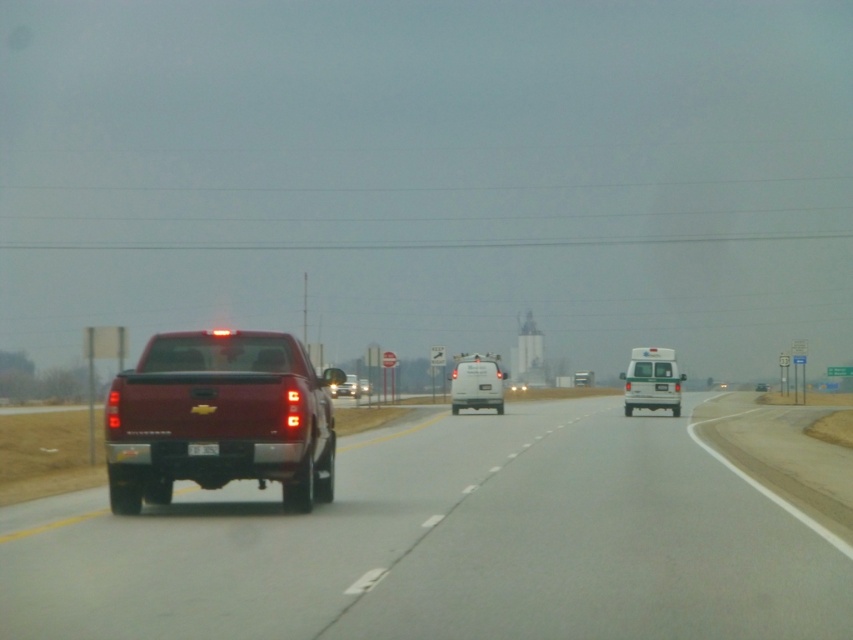
Question: Which point is closer to the camera taking this photo?

Choices:
 (A) (476, 390)
 (B) (196, 445)

Answer: (B)

Question: Is white glossy van at center behind white matte van at center?

Choices:
 (A) yes
 (B) no

Answer: (B)

Question: Which point is farther from the camera taking this photo?

Choices:
 (A) (347, 372)
 (B) (662, 384)
 (C) (276, 506)

Answer: (A)

Question: Can you confirm if metallic red truck at left is smaller than metallic red truck at center?

Choices:
 (A) yes
 (B) no

Answer: (B)

Question: Estimate the real-world distances between objects in this image. Which object is closer to the black plastic license plate at center?

Choices:
 (A) white glossy van at center
 (B) white matte van at center
 (C) shiny red truck at left

Answer: (C)

Question: Is white matte van at center wider than metallic silver sedan at center?

Choices:
 (A) yes
 (B) no

Answer: (B)